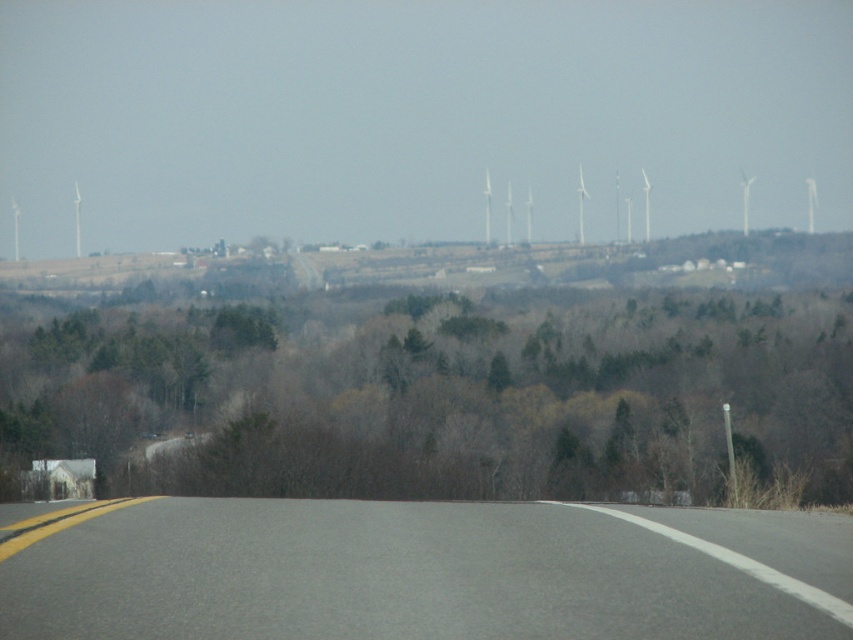
The height and width of the screenshot is (640, 853). What are the coordinates of `brown/dry wood trees at center` in the screenshot? It's located at (450, 401).

Can you confirm if brown/dry wood trees at center is thinner than gray asphalt road at center?

No.

Does point (592, 436) come in front of point (602, 538)?

No, (592, 436) is further to viewer.

Where is `brown/dry wood trees at center`? The height and width of the screenshot is (640, 853). brown/dry wood trees at center is located at coordinates (450, 401).

Who is lower down, gray asphalt road at center or white plastic windmill at upper center?

gray asphalt road at center is below.

Is gray asphalt road at center below white plastic windmill at upper center?

Yes, gray asphalt road at center is below white plastic windmill at upper center.

Does point (426, 618) come closer to viewer compared to point (74, 204)?

Yes, it is.

Identify the location of gray asphalt road at center. (419, 572).

Is gray asphalt road at center below white plastic wind turbines at upper center?

Yes.

Between gray asphalt road at center and white plastic wind turbines at upper center, which one appears on the left side from the viewer's perspective?

gray asphalt road at center is more to the left.

Does point (550, 600) lie behind point (618, 241)?

No, it is in front of (618, 241).

I want to click on gray asphalt road at center, so tap(419, 572).